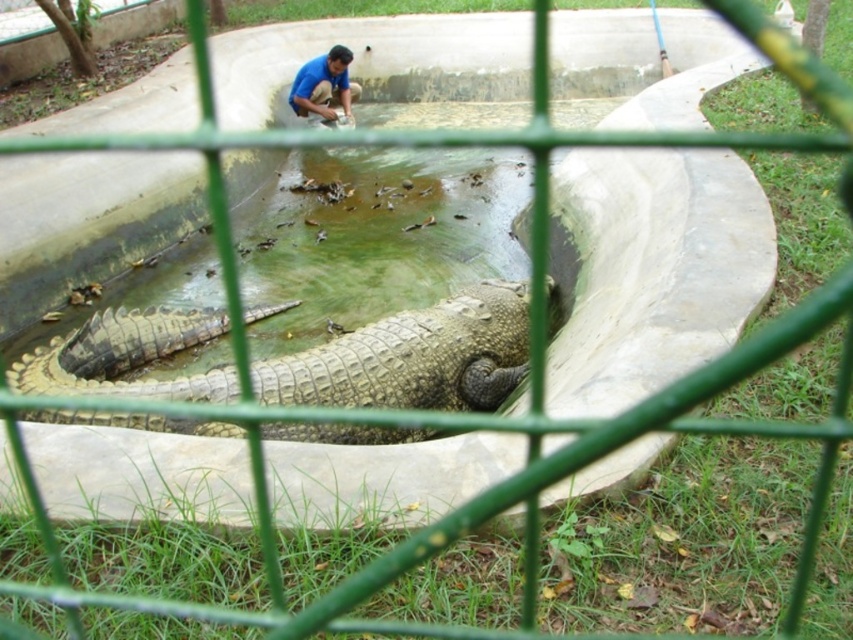
Is leathery brown crocodile at center positioned in front of blue shirt at upper center?

Yes.

Does leathery brown crocodile at center appear under blue shirt at upper center?

Yes, leathery brown crocodile at center is below blue shirt at upper center.

You are a GUI agent. You are given a task and a screenshot of the screen. Output one action in this format:
    pyautogui.click(x=<x>, y=<y>)
    Task: Click on the leathery brown crocodile at center
    The width and height of the screenshot is (853, 640).
    Given the screenshot: What is the action you would take?
    pyautogui.click(x=413, y=356)